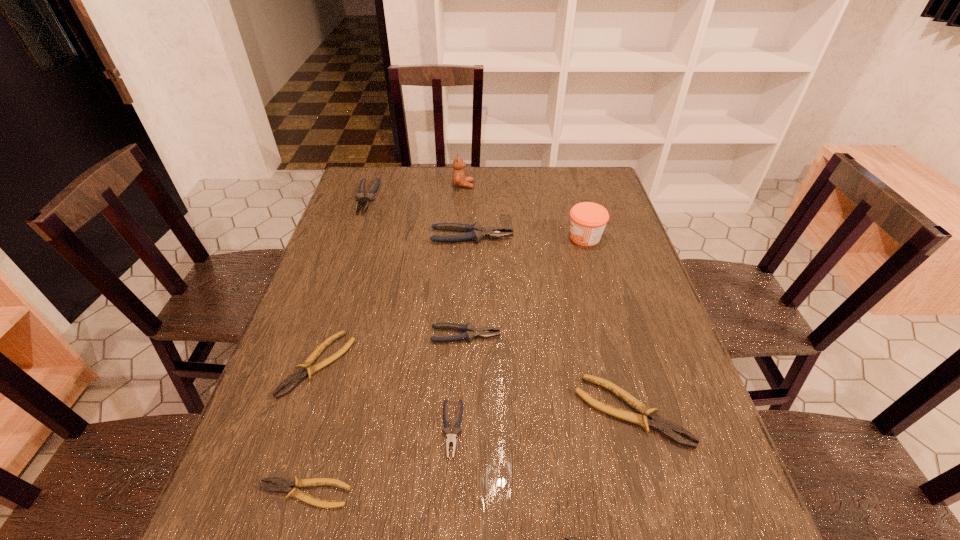
At what (x,y) coordinates should I click in order to perform the action: click on the nearest gray pliers. Please return your answer as a coordinate pair (x, y). The width and height of the screenshot is (960, 540). Looking at the image, I should click on (451, 438).

Identify the location of the second nearest yellow pliers. (283, 485).

This screenshot has height=540, width=960. I want to click on the ninth farthest object, so click(283, 485).

Find the location of a particular element. vacant space located 0.110m on the face of the teddy bear is located at coordinates (505, 185).

Where is `vacant space situated 0.050m on the front label of the jam`? vacant space situated 0.050m on the front label of the jam is located at coordinates (550, 237).

Find the location of a particular element. This screenshot has width=960, height=540. vacant region located on the front label of the jam is located at coordinates (459, 237).

Where is `free space located 0.320m on the front label of the jam`? free space located 0.320m on the front label of the jam is located at coordinates (462, 237).

Locate an element on the screen. vacant space positioned at the gripping part of the eighth shortest object is located at coordinates (630, 237).

This screenshot has height=540, width=960. Find the location of `vacant area situated at the gripping part of the leftmost gray pliers`. vacant area situated at the gripping part of the leftmost gray pliers is located at coordinates (338, 281).

Identify the location of vacant position located at the gripping part of the third farthest gray pliers. (611, 335).